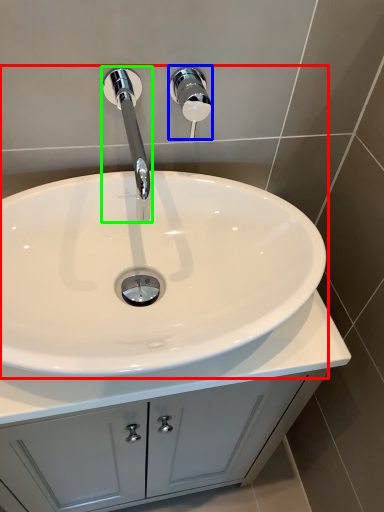
Question: Which is farther away from sink (highlighted by a red box)? shower (highlighted by a blue box) or tap (highlighted by a green box)?

Choices:
 (A) shower
 (B) tap

Answer: (A)